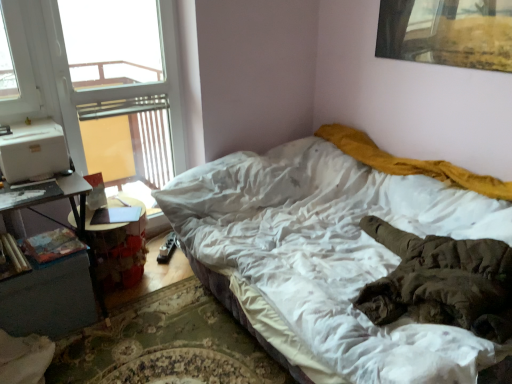
Question: Considering the relative sizes of wooden table at left and hardcover book at lower left, acting as the second book starting from the left, in the image provided, is wooden table at left taller than hardcover book at lower left, acting as the second book starting from the left,?

Choices:
 (A) no
 (B) yes

Answer: (B)

Question: Does wooden table at left have a greater width compared to hardcover book at lower left, acting as the second book starting from the left?

Choices:
 (A) yes
 (B) no

Answer: (A)

Question: Can you confirm if wooden table at left is positioned to the right of hardcover book at lower left, acting as the second book starting from the left?

Choices:
 (A) yes
 (B) no

Answer: (A)

Question: Does wooden table at left come in front of hardcover book at lower left, marked as the first book in a right-to-left arrangement?

Choices:
 (A) yes
 (B) no

Answer: (B)

Question: Does wooden table at left turn towards hardcover book at lower left, acting as the second book starting from the left?

Choices:
 (A) no
 (B) yes

Answer: (A)

Question: Is wooden table at left further to camera compared to hardcover book at lower left, marked as the first book in a right-to-left arrangement?

Choices:
 (A) no
 (B) yes

Answer: (B)

Question: Is transparent glass window at upper left not within wooden cylindrical at left, which is the second book from right to left?

Choices:
 (A) yes
 (B) no

Answer: (A)

Question: Is transparent glass window at upper left behind wooden cylindrical at left, which is the second book from right to left?

Choices:
 (A) yes
 (B) no

Answer: (A)

Question: Is transparent glass window at upper left facing away from wooden cylindrical at left, the first book from the left?

Choices:
 (A) no
 (B) yes

Answer: (A)

Question: Could you tell me if transparent glass window at upper left is turned towards wooden cylindrical at left, the first book from the left?

Choices:
 (A) no
 (B) yes

Answer: (A)

Question: Is transparent glass window at upper left wider than wooden cylindrical at left, the first book from the left?

Choices:
 (A) no
 (B) yes

Answer: (A)

Question: Is wooden cylindrical at left, which is the second book from right to left, completely or partially inside transparent glass window at upper left?

Choices:
 (A) no
 (B) yes

Answer: (A)

Question: Is wooden table at left facing away from dark gray wood nightstand at lower left?

Choices:
 (A) no
 (B) yes

Answer: (A)